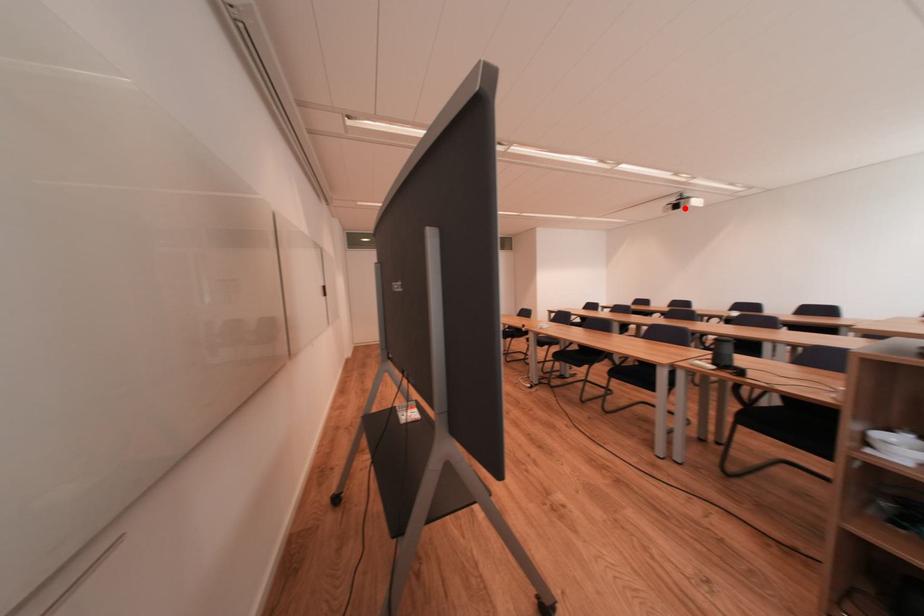
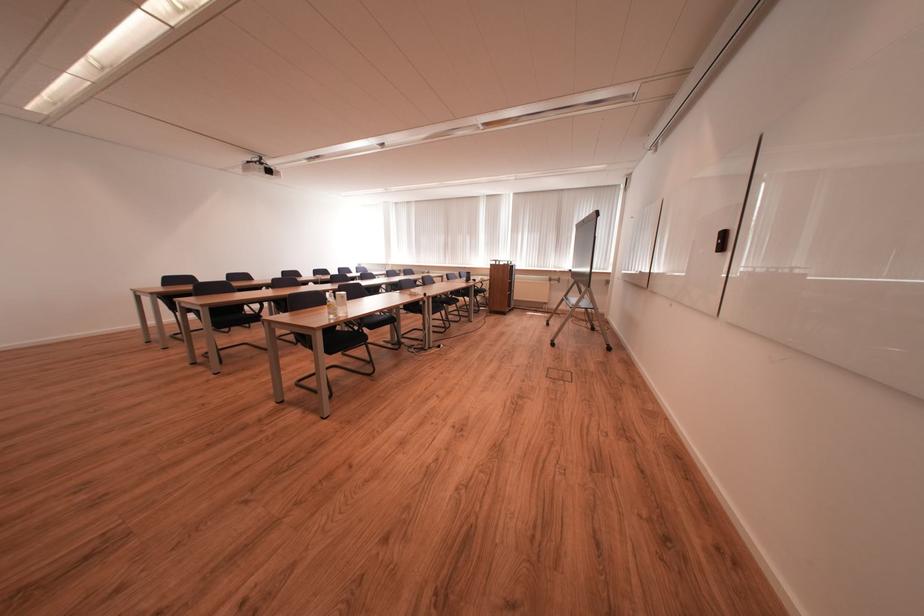
The point at the highlighted location is marked in the first image. Where is the corresponding point in the second image?

(277, 174)